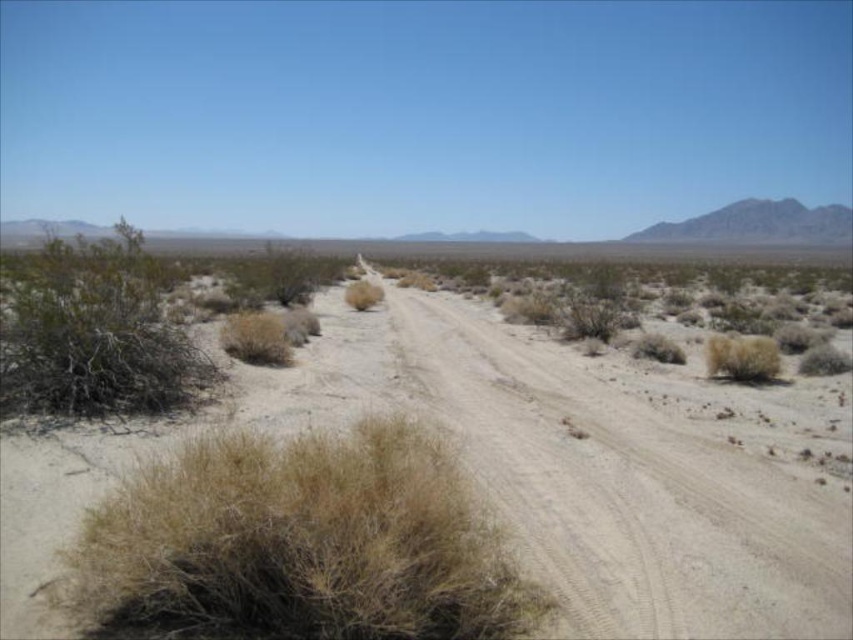
Locate an element on the screen. The image size is (853, 640). dusty sand at center is located at coordinates (627, 490).

Does dusty sand at center come in front of dry grass at lower left?

That is False.

Locate an element on the screen. The image size is (853, 640). dusty sand at center is located at coordinates (627, 490).

Find the location of `dusty sand at center`. dusty sand at center is located at coordinates (627, 490).

Is the position of dusty sand at center more distant than that of brown dry bush at left?

No.

Which is below, dusty sand at center or brown dry bush at left?

dusty sand at center is lower down.

Measure the distance between dusty sand at center and camera.

dusty sand at center and camera are 6.21 meters apart from each other.

Locate an element on the screen. The image size is (853, 640). dusty sand at center is located at coordinates (627, 490).

Does dry grass at lower left have a lesser height compared to brown dry bush at left?

Yes, dry grass at lower left is shorter than brown dry bush at left.

In the scene shown: Is dry grass at lower left to the right of brown dry bush at left from the viewer's perspective?

Indeed, dry grass at lower left is positioned on the right side of brown dry bush at left.

At what (x,y) coordinates should I click in order to perform the action: click on dry grass at lower left. Please return your answer as a coordinate pair (x, y). Looking at the image, I should click on (299, 544).